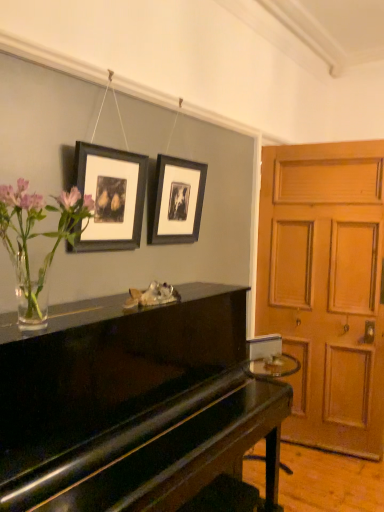
Question: Does black matte picture frame at upper center, the first picture frame in the back-to-front sequence, have a lesser height compared to matte black picture frame at upper center, positioned as the 2th picture frame in back-to-front order?

Choices:
 (A) no
 (B) yes

Answer: (B)

Question: Is black matte picture frame at upper center, which appears as the 2th picture frame when viewed from the left, completely or partially outside of matte black picture frame at upper center, positioned as the second picture frame in right-to-left order?

Choices:
 (A) no
 (B) yes

Answer: (B)

Question: Can matte black picture frame at upper center, positioned as the 2th picture frame in back-to-front order, be found inside black matte picture frame at upper center, the 2th picture frame when ordered from front to back?

Choices:
 (A) yes
 (B) no

Answer: (B)

Question: Is black matte picture frame at upper center, the first picture frame in the back-to-front sequence, positioned far away from matte black picture frame at upper center, the 1th picture frame viewed from the left?

Choices:
 (A) yes
 (B) no

Answer: (B)

Question: From a real-world perspective, is black matte picture frame at upper center, the first picture frame in the back-to-front sequence, beneath matte black picture frame at upper center, the 1th picture frame viewed from the left?

Choices:
 (A) no
 (B) yes

Answer: (A)

Question: Considering the positions of point (299, 438) and point (185, 183), is point (299, 438) closer or farther from the camera than point (185, 183)?

Choices:
 (A) farther
 (B) closer

Answer: (A)

Question: Considering the relative positions of wooden door at right and black matte picture frame at upper center, which appears as the 2th picture frame when viewed from the left, in the image provided, is wooden door at right to the left or to the right of black matte picture frame at upper center, which appears as the 2th picture frame when viewed from the left,?

Choices:
 (A) left
 (B) right

Answer: (B)

Question: From the image's perspective, is wooden door at right above or below black matte picture frame at upper center, the first picture frame in the back-to-front sequence?

Choices:
 (A) below
 (B) above

Answer: (A)

Question: From a real-world perspective, relative to black matte picture frame at upper center, the 2th picture frame when ordered from front to back, is wooden door at right vertically above or below?

Choices:
 (A) above
 (B) below

Answer: (B)

Question: Is clear glass vase with flowers at left bigger or smaller than glossy black piano at center?

Choices:
 (A) big
 (B) small

Answer: (B)

Question: From a real-world perspective, relative to glossy black piano at center, is clear glass vase with flowers at left vertically above or below?

Choices:
 (A) above
 (B) below

Answer: (A)

Question: Is clear glass vase with flowers at left wider or thinner than glossy black piano at center?

Choices:
 (A) wide
 (B) thin

Answer: (B)

Question: Is clear glass vase with flowers at left in front of or behind glossy black piano at center in the image?

Choices:
 (A) behind
 (B) front

Answer: (A)

Question: Is black matte picture frame at upper center, the 2th picture frame when ordered from front to back, wider or thinner than wooden door at right?

Choices:
 (A) wide
 (B) thin

Answer: (B)

Question: In terms of size, does black matte picture frame at upper center, the 2th picture frame when ordered from front to back, appear bigger or smaller than wooden door at right?

Choices:
 (A) big
 (B) small

Answer: (B)